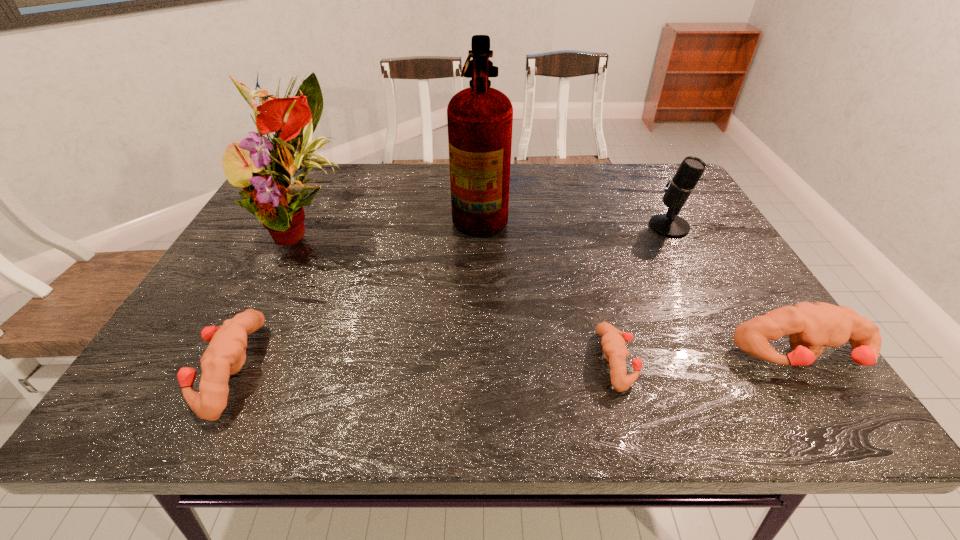
I want to click on puncher that is at the right edge, so click(x=811, y=327).

Find the location of `microphone at the right edge`. microphone at the right edge is located at coordinates (678, 190).

Image resolution: width=960 pixels, height=540 pixels. I want to click on object that is at the far left corner, so click(x=277, y=199).

Locate an element on the screen. object that is at the near left corner is located at coordinates (226, 354).

Locate an element on the screen. Image resolution: width=960 pixels, height=540 pixels. object that is at the near right corner is located at coordinates (811, 327).

Find the location of `free space at the far edge`. free space at the far edge is located at coordinates coord(450,204).

The height and width of the screenshot is (540, 960). I want to click on free space at the near edge, so click(594, 352).

At what (x,y) coordinates should I click in order to perform the action: click on free space at the left edge. Please return your answer as a coordinate pair (x, y). This screenshot has width=960, height=540. Looking at the image, I should click on (242, 244).

This screenshot has height=540, width=960. I want to click on free space at the right edge of the desktop, so click(700, 295).

Locate an element on the screen. This screenshot has width=960, height=540. vacant space at the far left corner of the desktop is located at coordinates (311, 184).